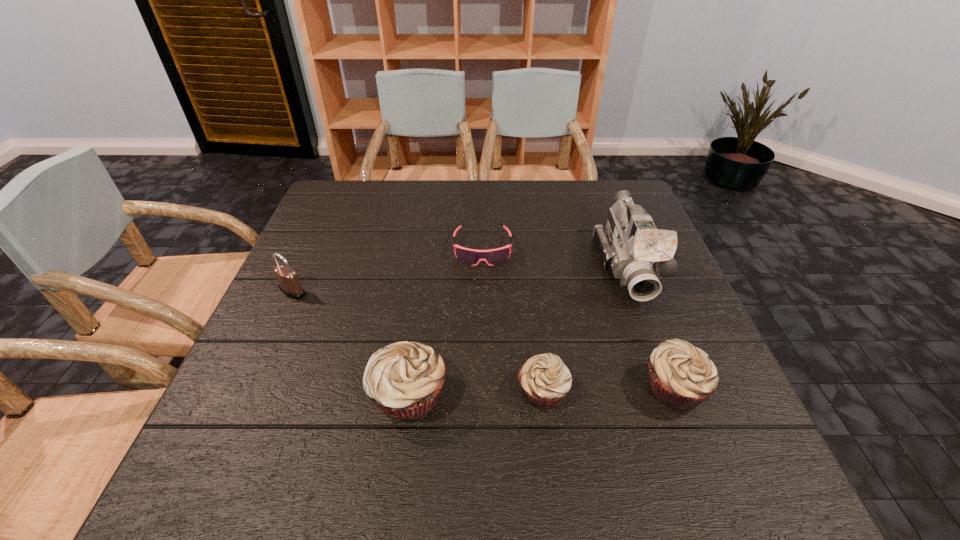
The width and height of the screenshot is (960, 540). I want to click on free space between the leftmost muffin and the leftmost object, so click(350, 343).

This screenshot has width=960, height=540. Identify the location of vacant region between the padlock and the shortest object. (388, 270).

Where is `vacant region between the camcorder and the shortest object`? vacant region between the camcorder and the shortest object is located at coordinates (555, 258).

Identify which object is located as the second nearest to the shortest muffin. Please provide its 2D coordinates. Your answer should be formatted as a tuple, i.e. [(x, y)], where the tuple contains the x and y coordinates of a point satisfying the conditions above.

[(682, 376)]

The width and height of the screenshot is (960, 540). I want to click on object that is the fourth closest to the leftmost muffin, so click(x=682, y=376).

Locate an element on the screen. This screenshot has width=960, height=540. muffin that is the closest to the shortest muffin is located at coordinates (404, 379).

The width and height of the screenshot is (960, 540). In order to click on muffin that is the second closest to the fourth tallest object in this screenshot , I will do `click(404, 379)`.

Image resolution: width=960 pixels, height=540 pixels. What are the coordinates of `blank area in the image that satisfies the following two spatial constraints: 1. on the front-facing side of the rightmost muffin; 2. on the left side of the tallest object` in the screenshot? It's located at (672, 388).

The width and height of the screenshot is (960, 540). Identify the location of vacant space that satisfies the following two spatial constraints: 1. on the front-facing side of the shortest object; 2. on the left side of the shortest muffin. (483, 392).

Where is `free point that satisfies the following two spatial constraints: 1. on the front-facing side of the shortest object; 2. on the right side of the fifth tallest object`? Image resolution: width=960 pixels, height=540 pixels. free point that satisfies the following two spatial constraints: 1. on the front-facing side of the shortest object; 2. on the right side of the fifth tallest object is located at coordinates (483, 392).